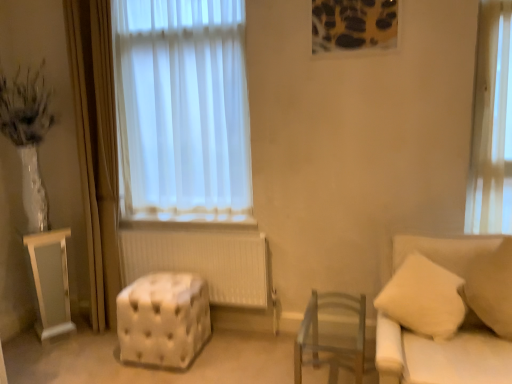
Question: Is white fabric couch at right in front of or behind beige fabric pillow at right in the image?

Choices:
 (A) behind
 (B) front

Answer: (B)

Question: Considering the positions of white fabric couch at right and beige fabric pillow at right in the image, is white fabric couch at right wider or thinner than beige fabric pillow at right?

Choices:
 (A) thin
 (B) wide

Answer: (B)

Question: Based on their relative distances, which object is farther from the white tufted ottoman at center?

Choices:
 (A) white glossy cabinet at left
 (B) beige fabric pillow at right
 (C) clear wood chair at center
 (D) white fabric couch at right

Answer: (B)

Question: Which object is positioned closest to the white glossy cabinet at left?

Choices:
 (A) white fabric couch at right
 (B) white tufted ottoman at center
 (C) clear wood chair at center
 (D) beige fabric pillow at right

Answer: (B)